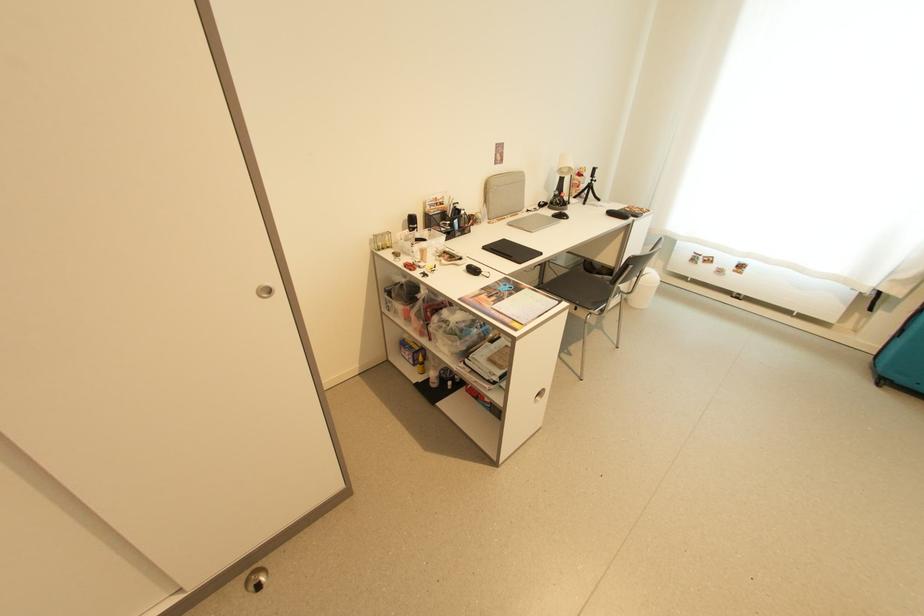
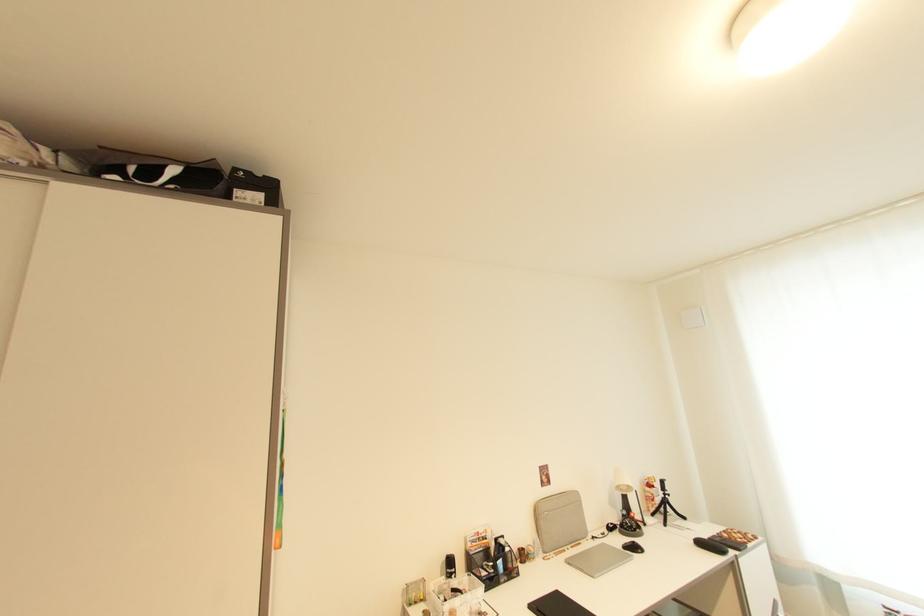
Locate, in the second image, the point that corresponds to the point at 411,219 in the first image.

(450, 561)